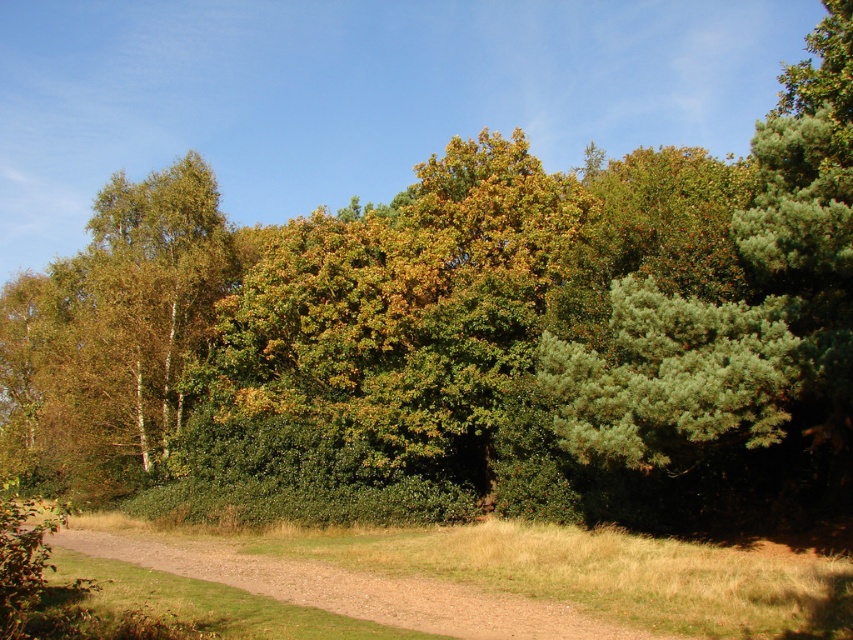
Question: Which object appears farthest from the camera in this image?

Choices:
 (A) green leafy tree at center
 (B) green leafy tree at left
 (C) brown gravel path at lower center

Answer: (B)

Question: Estimate the real-world distances between objects in this image. Which object is closer to the green leafy tree at center?

Choices:
 (A) green leafy tree at left
 (B) brown gravel path at lower center

Answer: (B)

Question: Can you confirm if green leafy tree at left is wider than brown gravel path at lower center?

Choices:
 (A) yes
 (B) no

Answer: (A)

Question: Which point appears closest to the camera in this image?

Choices:
 (A) (144, 332)
 (B) (492, 614)
 (C) (474, 154)

Answer: (B)

Question: Is green leafy tree at center bigger than brown gravel path at lower center?

Choices:
 (A) no
 (B) yes

Answer: (B)

Question: Can you confirm if green leafy tree at left is smaller than brown gravel path at lower center?

Choices:
 (A) no
 (B) yes

Answer: (A)